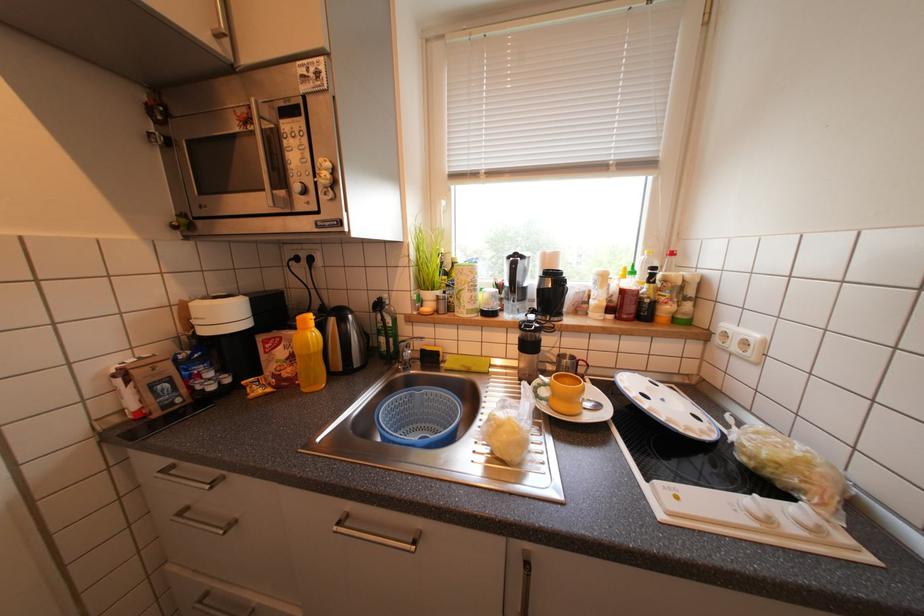
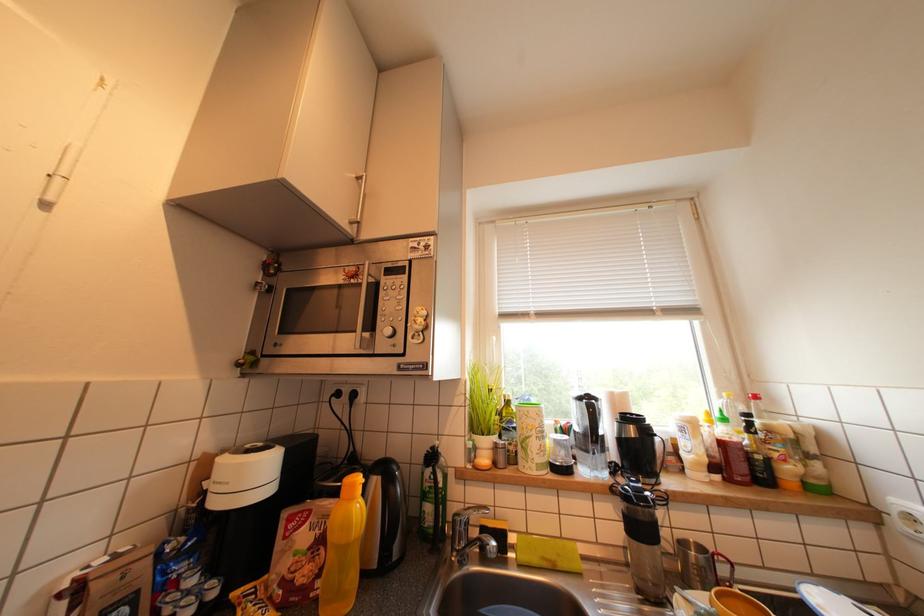
Question: In a continuous first-person perspective shot, in which direction is the camera moving?

Choices:
 (A) Left
 (B) Right
 (C) Forward
 (D) Backward

Answer: (A)